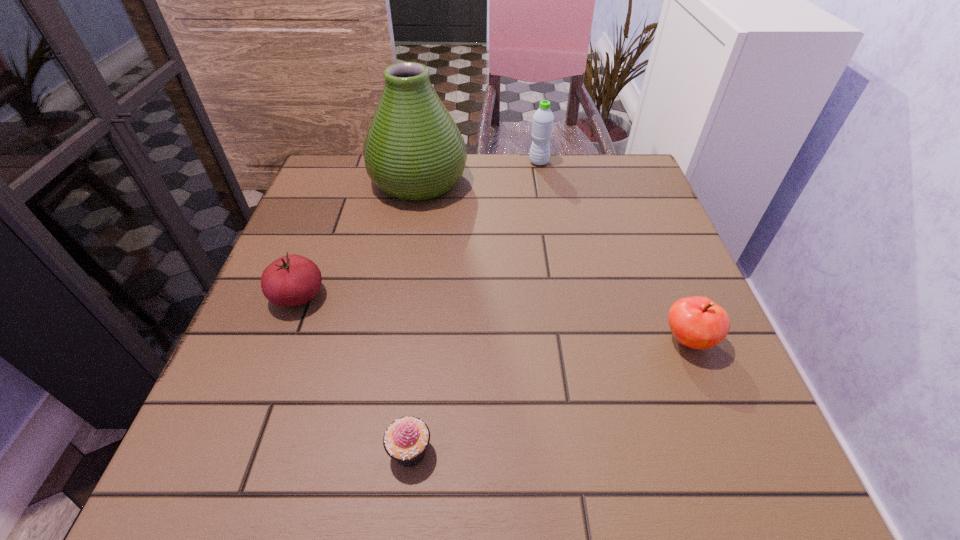
Locate an element on the screen. free space between the third nearest object and the fourth shortest object is located at coordinates (419, 229).

The width and height of the screenshot is (960, 540). In order to click on vacant area between the tomato and the nearest object in this screenshot , I will do `click(354, 374)`.

The image size is (960, 540). Identify the location of free space that is in between the third nearest object and the shortest object. (354, 374).

This screenshot has height=540, width=960. In order to click on vacant space in between the nearest object and the third nearest object in this screenshot , I will do `click(354, 374)`.

Find the location of a particular element. unoccupied area between the apple and the fourth object from left to right is located at coordinates (613, 251).

Find the location of a particular element. This screenshot has height=540, width=960. free spot between the second object from right to left and the third farthest object is located at coordinates (419, 229).

Locate an element on the screen. The width and height of the screenshot is (960, 540). blank region between the water bottle and the vase is located at coordinates (479, 172).

This screenshot has height=540, width=960. Identify the location of unoccupied area between the fourth shortest object and the vase. (479, 172).

Where is `the third closest object to the second tallest object`? Image resolution: width=960 pixels, height=540 pixels. the third closest object to the second tallest object is located at coordinates (291, 280).

Select which object appears as the third closest to the third farthest object. Please provide its 2D coordinates. Your answer should be formatted as a tuple, i.e. [(x, y)], where the tuple contains the x and y coordinates of a point satisfying the conditions above.

[(543, 119)]